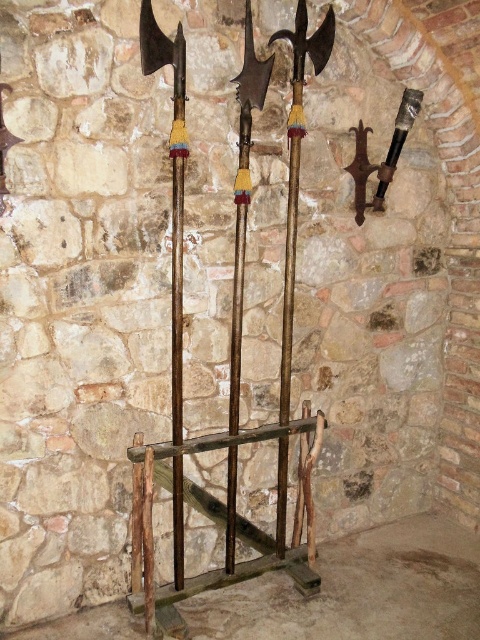
This screenshot has width=480, height=640. I want to click on rusty wood ladder at center, so coord(228,515).

Who is shorter, rusty wood ladder at center or wooden polished axe at center?

Standing shorter between the two is rusty wood ladder at center.

Who is more forward, (x=282, y=460) or (x=302, y=125)?

Point (x=302, y=125) is in front.

Locate an element on the screen. rusty wood ladder at center is located at coordinates (228, 515).

Between rusty metal axe at center and polished silver sword at upper right, which one has less height?

Standing shorter between the two is polished silver sword at upper right.

Does rusty metal axe at center have a lesser height compared to polished silver sword at upper right?

In fact, rusty metal axe at center may be taller than polished silver sword at upper right.

In order to click on rusty metal axe at center in this screenshot , I will do `click(172, 180)`.

Where is `rusty metal axe at center`? The width and height of the screenshot is (480, 640). rusty metal axe at center is located at coordinates (172, 180).

Does smooth stone floor at lower center have a larger size compared to polished silver sword at upper right?

Yes.

Is smooth stone floor at lower center further to camera compared to polished silver sword at upper right?

No, smooth stone floor at lower center is closer to the viewer.

Is point (403, 548) farther from camera compared to point (382, 198)?

Yes, it is behind point (382, 198).

At what (x,y) coordinates should I click in order to perform the action: click on smooth stone floor at lower center. Please return your answer as a coordinate pair (x, y). This screenshot has height=640, width=480. Looking at the image, I should click on (360, 589).